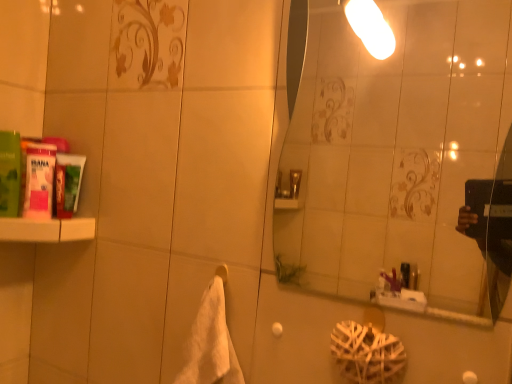
Question: Is point (275, 322) positioned closer to the camera than point (480, 294)?

Choices:
 (A) closer
 (B) farther

Answer: (A)

Question: From a real-world perspective, is white matte towel bar at lower center physically located above or below transparent glass mirror at upper center?

Choices:
 (A) above
 (B) below

Answer: (B)

Question: Which object is positioned farthest from the green matte mouthwash at left, the 3th mouthwash from the right?

Choices:
 (A) green matte tube at left, which appears as the third mouthwash when viewed from the left
 (B) pink matte tube at left, the 2th mouthwash from the left
 (C) transparent glass mirror at upper center
 (D) white matte towel bar at lower center
 (E) white soft towel at center

Answer: (C)

Question: Estimate the real-world distances between objects in this image. Which object is closer to the green matte mouthwash at left, the 3th mouthwash from the right?

Choices:
 (A) white soft towel at center
 (B) white matte towel bar at lower center
 (C) transparent glass mirror at upper center
 (D) white matte shelf at left
 (E) green matte tube at left, which appears as the third mouthwash when viewed from the left

Answer: (D)